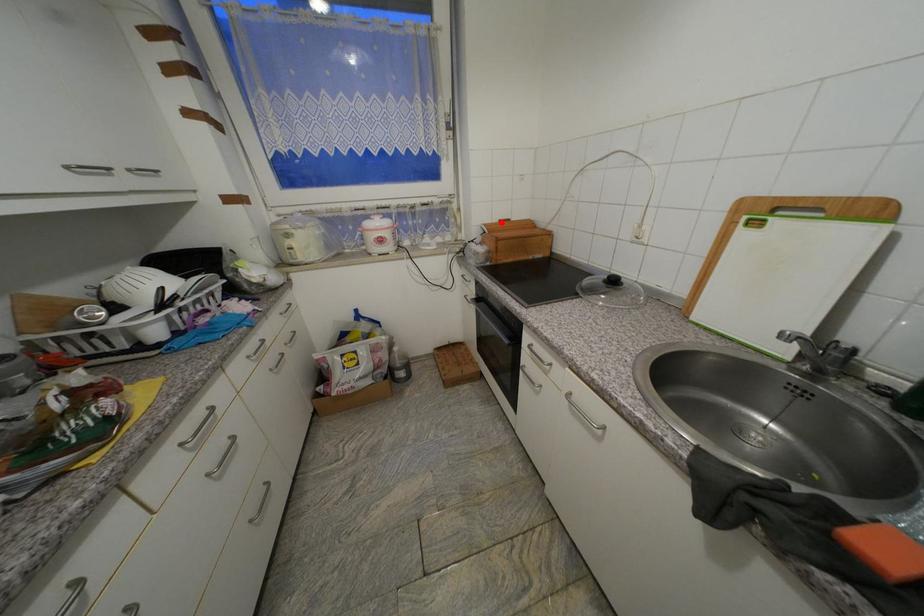
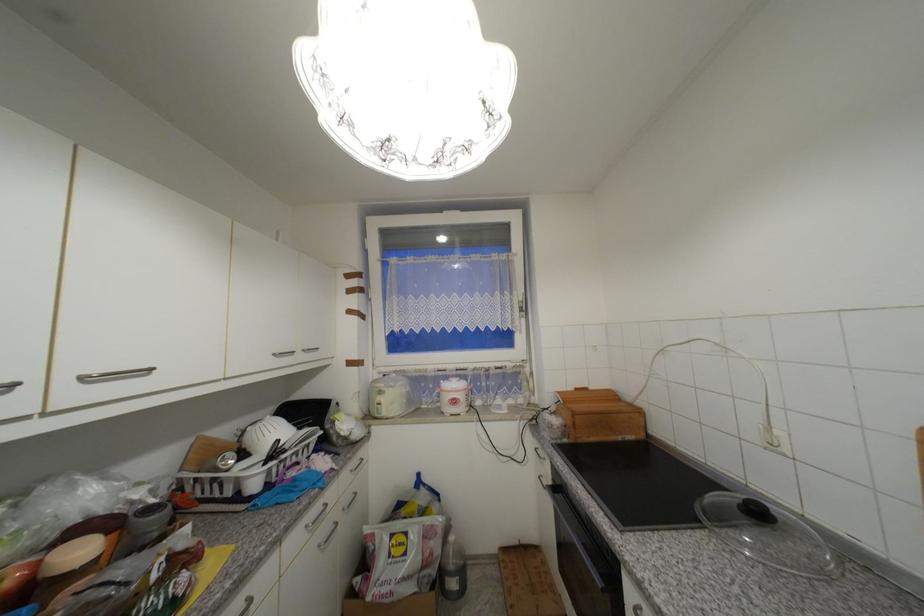
Find the pixel in the second image that matches the highlighted location in the first image.

(576, 390)